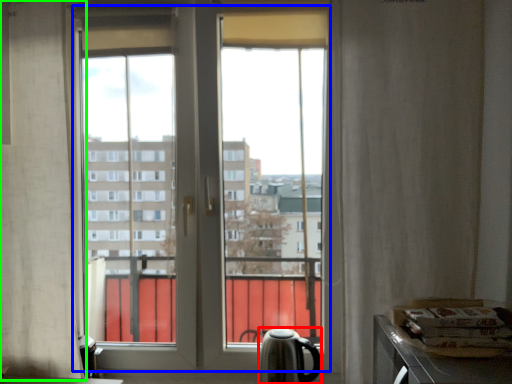
Question: Which is farther away from tea pot (highlighted by a red box)? bay window (highlighted by a blue box) or curtain (highlighted by a green box)?

Choices:
 (A) bay window
 (B) curtain

Answer: (B)